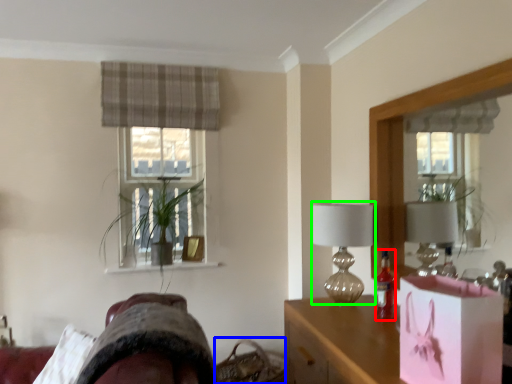
Question: Estimate the real-world distances between objects in this image. Which object is closer to bottle (highlighted by a red box), basket (highlighted by a blue box) or table lamp (highlighted by a green box)?

Choices:
 (A) basket
 (B) table lamp

Answer: (B)